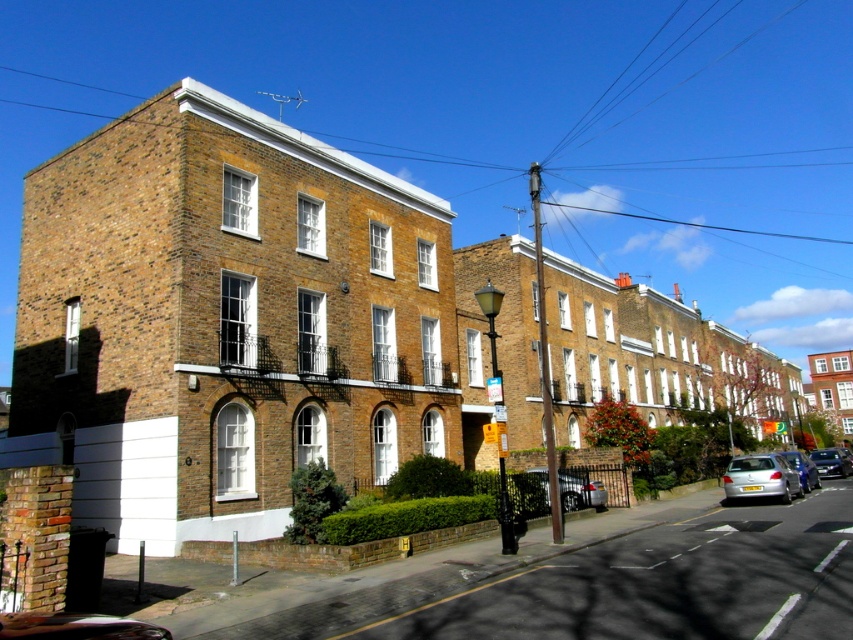
Question: Does shiny silver car at lower right appear on the left side of metallic silver sedan at lower right?

Choices:
 (A) no
 (B) yes

Answer: (B)

Question: Is silver metallic car at lower right below metallic silver car at lower right?

Choices:
 (A) no
 (B) yes

Answer: (B)

Question: Is silver metallic car at lower right above metallic silver car at lower right?

Choices:
 (A) no
 (B) yes

Answer: (A)

Question: Which object is positioned closest to the silver metallic car at lower right?

Choices:
 (A) metallic silver sedan at lower right
 (B) metallic silver car at lower right

Answer: (B)

Question: Which object is positioned closest to the silver metallic car at lower right?

Choices:
 (A) metallic silver sedan at lower right
 (B) shiny silver car at lower right
 (C) metallic silver car at lower right

Answer: (C)

Question: Which is nearer to the shiny silver car at lower right?

Choices:
 (A) metallic silver sedan at lower right
 (B) metallic silver car at lower right
 (C) silver metallic car at lower right

Answer: (C)